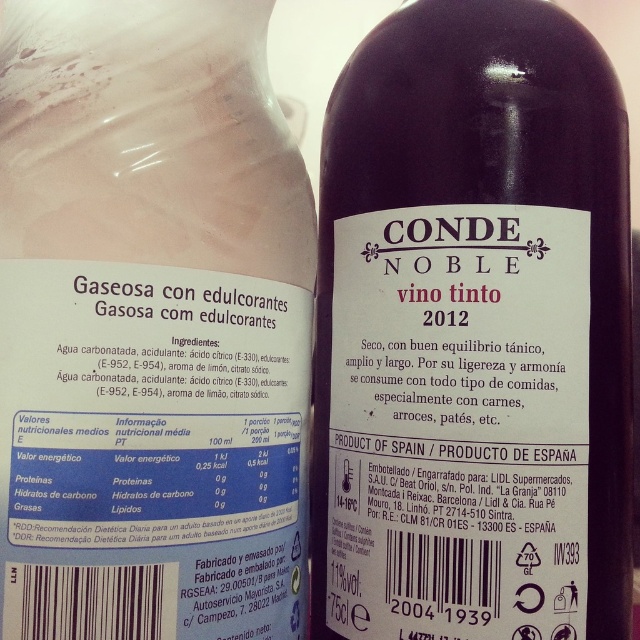
Identify the location of dark glass bottle at center. The height and width of the screenshot is (640, 640). (474, 332).

Which of these two, dark glass bottle at center or pink matte bottle at center, stands taller?

With more height is dark glass bottle at center.

Which is in front, point (435, 321) or point (260, 29)?

Point (435, 321) is more forward.

I want to click on dark glass bottle at center, so pos(474,332).